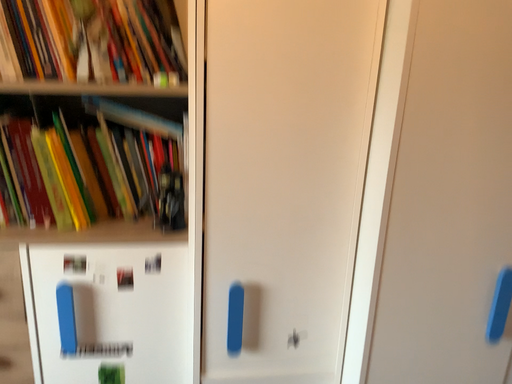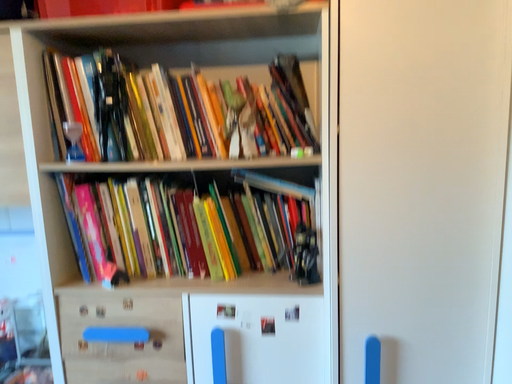
Question: Which way did the camera rotate in the video?

Choices:
 (A) rotated upward
 (B) rotated downward

Answer: (A)